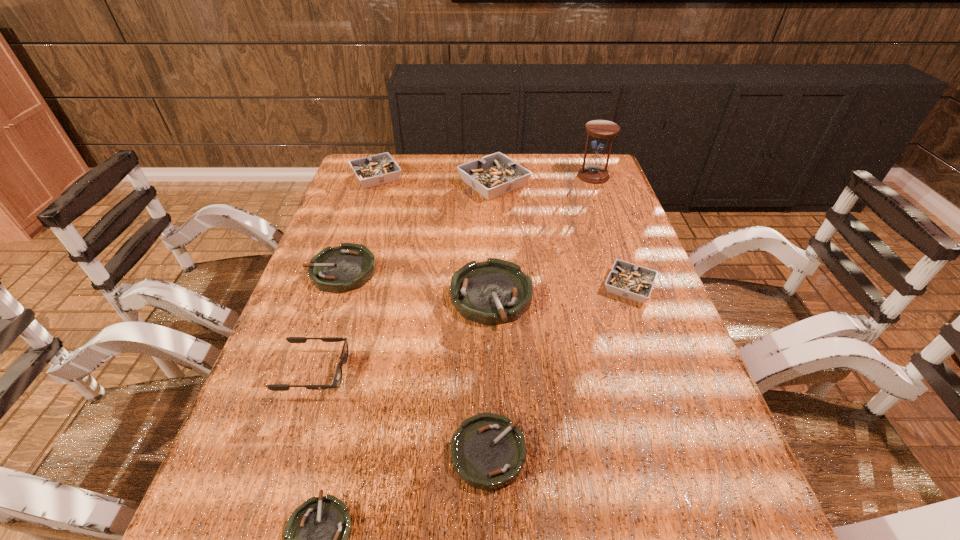
The image size is (960, 540). What are the coordinates of `the second shortest ashtray` in the screenshot? It's located at (488, 451).

In order to click on free space located 0.250m on the left of the second gray ashtray from right to left in this screenshot , I will do `click(382, 184)`.

I want to click on free space located 0.310m on the right of the second biggest gray ashtray, so click(495, 177).

Find the location of a particular element. Image resolution: width=960 pixels, height=540 pixels. free point located 0.230m on the back of the biggest green ashtray is located at coordinates (490, 217).

The height and width of the screenshot is (540, 960). I want to click on vacant space located 0.060m on the temples of the sunglasses, so click(375, 372).

What are the coordinates of `vacant point located on the left of the rightmost gray ashtray` in the screenshot? It's located at (573, 287).

Identify the location of vacant space located 0.090m on the right of the third smallest green ashtray. This screenshot has height=540, width=960. (410, 271).

Where is `vacant point located 0.360m on the back of the second nearest green ashtray`? Image resolution: width=960 pixels, height=540 pixels. vacant point located 0.360m on the back of the second nearest green ashtray is located at coordinates (486, 287).

Identify the location of hourglass at the far edge. Image resolution: width=960 pixels, height=540 pixels. (593, 172).

Where is `sunglasses present at the left edge`? This screenshot has width=960, height=540. sunglasses present at the left edge is located at coordinates (337, 380).